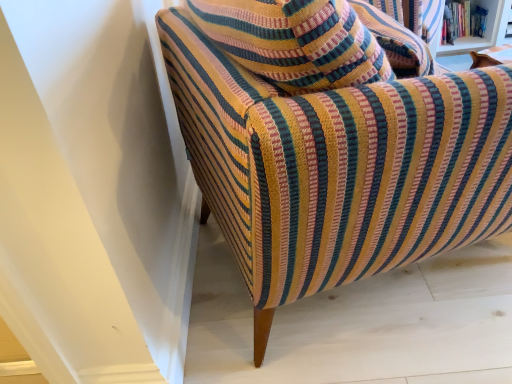
Question: From the image's perspective, relative to hardcover book at upper right, is textured striped armchair at center above or below?

Choices:
 (A) below
 (B) above

Answer: (A)

Question: Considering the positions of point (309, 168) and point (454, 28), is point (309, 168) closer or farther from the camera than point (454, 28)?

Choices:
 (A) farther
 (B) closer

Answer: (B)

Question: Would you say textured striped armchair at center is to the left or to the right of hardcover book at upper right in the picture?

Choices:
 (A) right
 (B) left

Answer: (B)

Question: From a real-world perspective, relative to textured striped armchair at center, is hardcover book at upper right vertically above or below?

Choices:
 (A) above
 (B) below

Answer: (B)

Question: Considering the positions of hardcover book at upper right and textured striped armchair at center in the image, is hardcover book at upper right taller or shorter than textured striped armchair at center?

Choices:
 (A) short
 (B) tall

Answer: (A)

Question: Considering the relative positions of hardcover book at upper right and textured striped armchair at center in the image provided, is hardcover book at upper right to the left or to the right of textured striped armchair at center?

Choices:
 (A) right
 (B) left

Answer: (A)

Question: Looking at the image, does hardcover book at upper right seem bigger or smaller compared to textured striped armchair at center?

Choices:
 (A) big
 (B) small

Answer: (B)